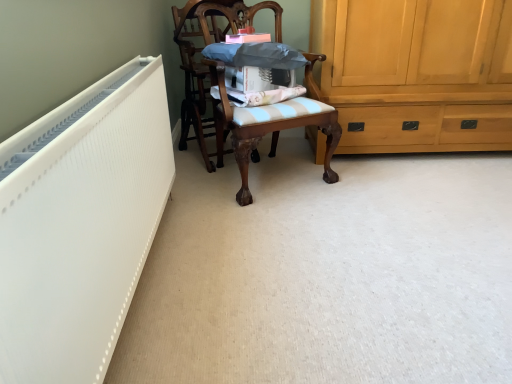
Question: Is light brown wood cabinet at right bigger or smaller than wooden chair at center, which is the 1th chair in right-to-left order?

Choices:
 (A) big
 (B) small

Answer: (A)

Question: From a real-world perspective, is light brown wood cabinet at right physically located above or below wooden chair at center, the 2th chair when ordered from left to right?

Choices:
 (A) below
 (B) above

Answer: (B)

Question: Which is farther from the wooden chair at center, which appears as the 2th chair when viewed from the right?

Choices:
 (A) blue striped fabric at center
 (B) white textured radiator at left
 (C) light brown wood cabinet at right
 (D) wooden chair at center, the 2th chair when ordered from left to right

Answer: (B)

Question: Which is nearer to the wooden chair at center, which is the 1th chair in right-to-left order?

Choices:
 (A) white textured radiator at left
 (B) light brown wood cabinet at right
 (C) blue striped fabric at center
 (D) wooden chair at center, marked as the 1th chair in a left-to-right arrangement

Answer: (C)